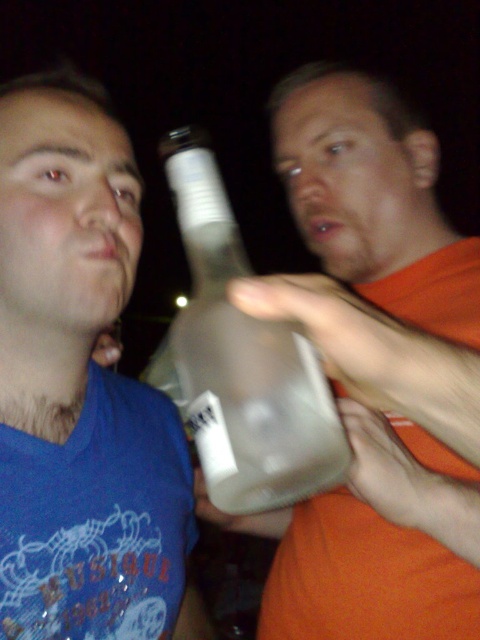
Question: Among these points, which one is nearest to the camera?

Choices:
 (A) (179, 625)
 (B) (388, 472)
 (C) (216, 483)

Answer: (C)

Question: Among these points, which one is farthest from the camera?

Choices:
 (A) (170, 573)
 (B) (201, 513)

Answer: (B)

Question: Which point is farther from the camera taking this photo?

Choices:
 (A) (307, 484)
 (B) (96, 305)

Answer: (B)

Question: Does translucent glass bottle at center appear on the right side of transparent plastic bottle at center?

Choices:
 (A) no
 (B) yes

Answer: (B)

Question: From the image, what is the correct spatial relationship of matte plastic bottle at left in relation to transparent plastic bottle at center?

Choices:
 (A) left
 (B) right

Answer: (B)

Question: Does matte plastic bottle at left have a smaller size compared to transparent plastic bottle at center?

Choices:
 (A) yes
 (B) no

Answer: (B)